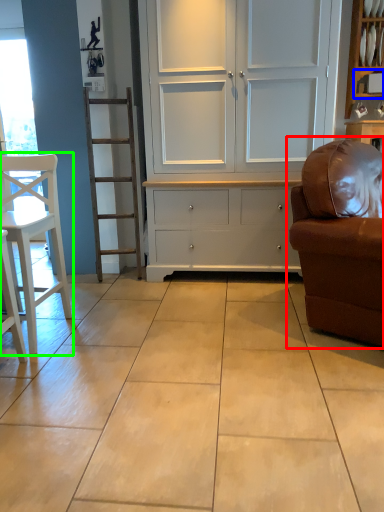
Question: Which object is the farthest from studio couch (highlighted by a red box)? Choose among these: shelf (highlighted by a blue box) or chair (highlighted by a green box).

Choices:
 (A) shelf
 (B) chair

Answer: (A)